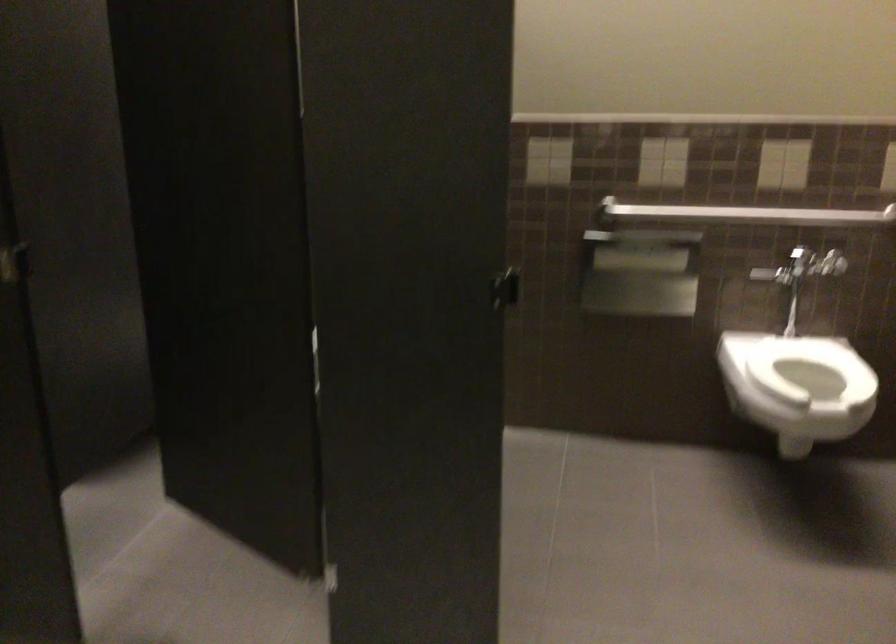
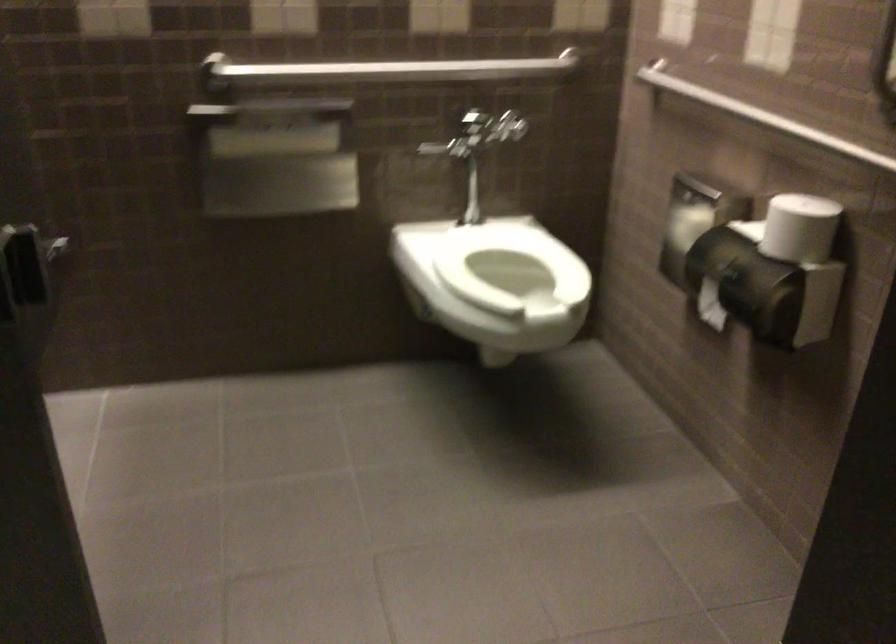
Question: How did the camera likely rotate?

Choices:
 (A) Left
 (B) Right
 (C) Up
 (D) Down

Answer: (B)